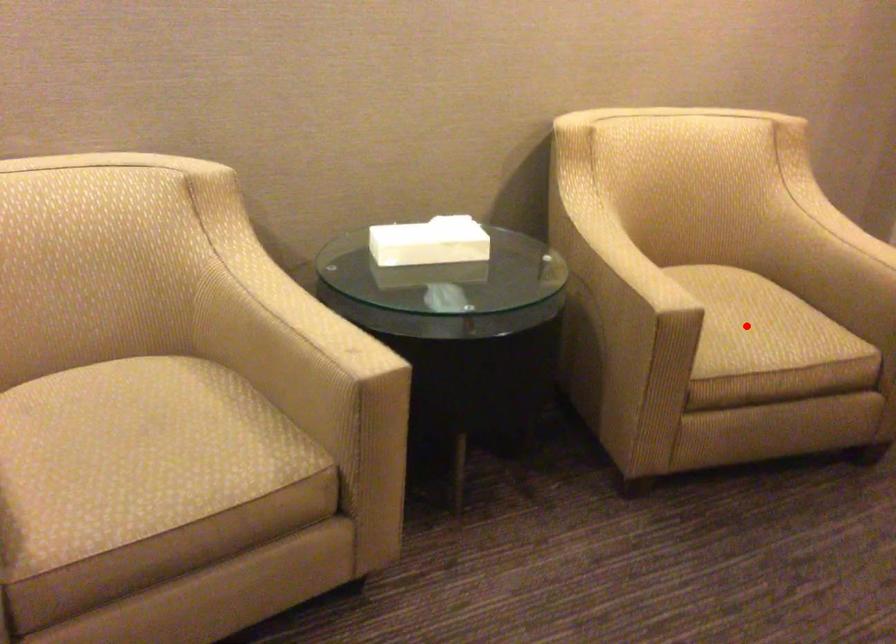
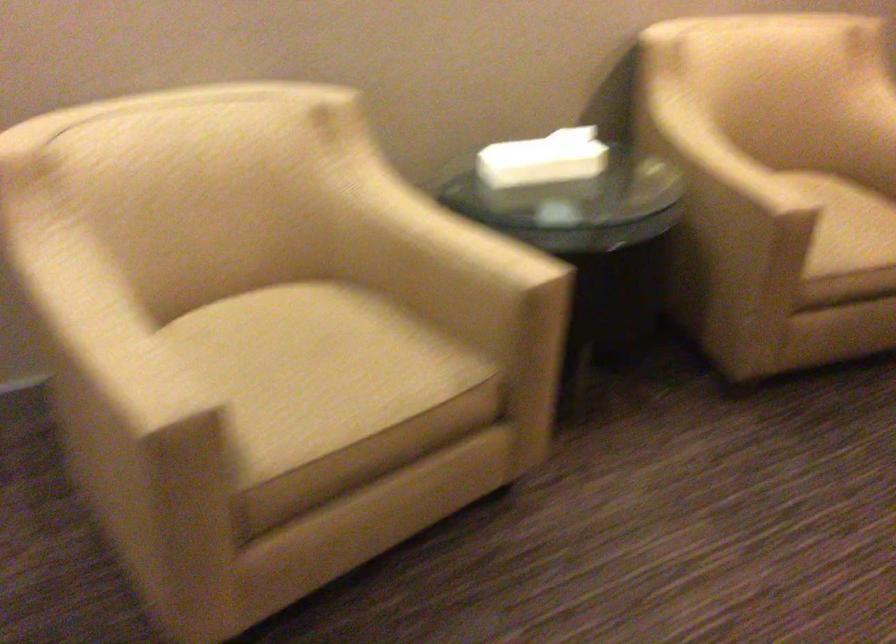
Find the pixel in the second image that matches the highlighted location in the first image.

(846, 225)